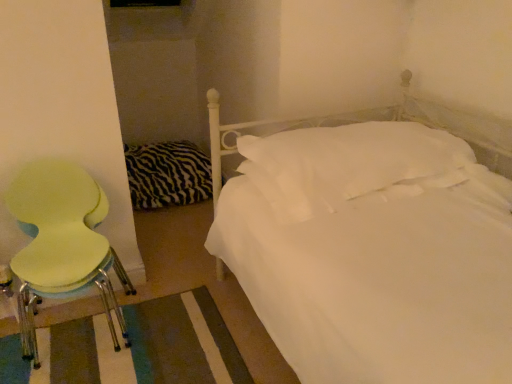
In order to click on vacant space underneath light green plastic chair at left (from a real-world perspective) in this screenshot , I will do `click(81, 332)`.